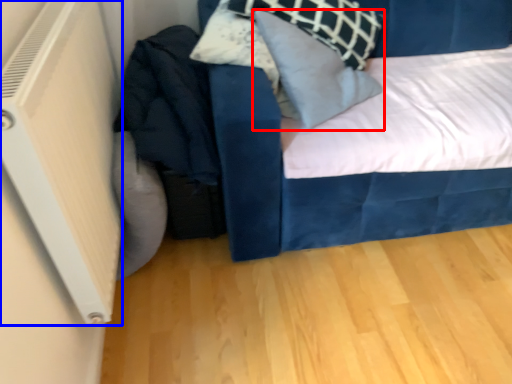
Question: Which of the following is the farthest to the observer, pillow (highlighted by a red box) or air conditioning (highlighted by a blue box)?

Choices:
 (A) pillow
 (B) air conditioning

Answer: (A)